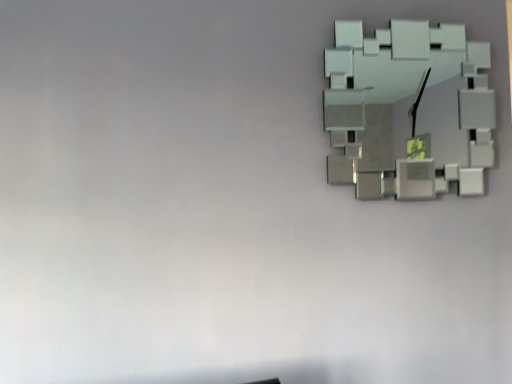
Question: Should I look upward or downward to see white matte clock at upper right?

Choices:
 (A) down
 (B) up

Answer: (B)